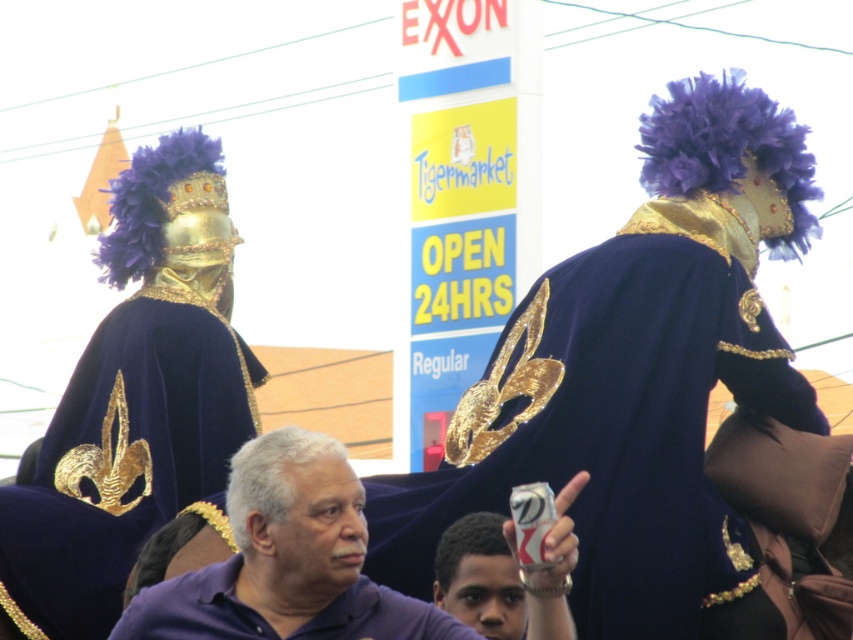
Question: Does purple matte shirt at center appear under purple velvet robe at center?

Choices:
 (A) yes
 (B) no

Answer: (B)

Question: Does velvet dark blue robe at center have a larger size compared to purple velvet robe at center?

Choices:
 (A) yes
 (B) no

Answer: (A)

Question: Observing the image, what is the correct spatial positioning of velvet dark blue robe at center in reference to purple matte shirt at center?

Choices:
 (A) left
 (B) right

Answer: (B)

Question: Which point is farther to the camera?

Choices:
 (A) purple velvet robe at center
 (B) purple matte shirt at center
 (C) velvet dark blue robe at center

Answer: (C)

Question: Which object is farther from the camera taking this photo?

Choices:
 (A) velvet dark blue robe at center
 (B) purple velvet robe at center
 (C) purple matte shirt at center

Answer: (A)

Question: Which of the following is the farthest from the observer?

Choices:
 (A) purple matte shirt at center
 (B) purple velvet robe at center

Answer: (B)